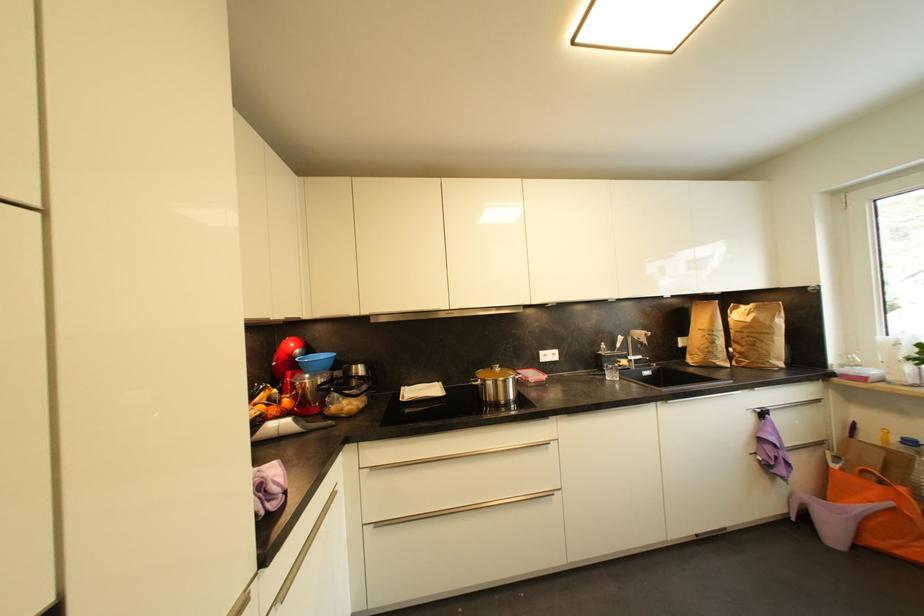
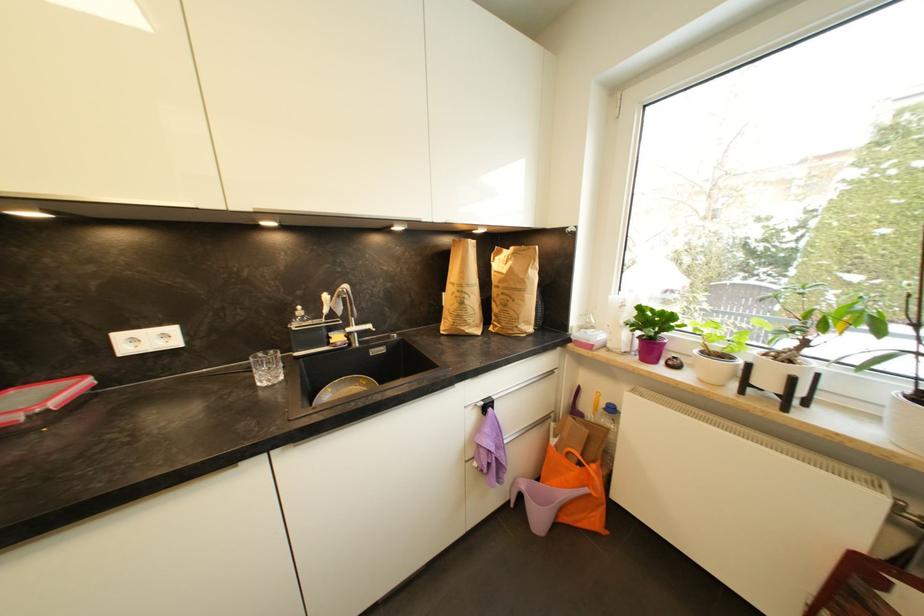
In a continuous first-person perspective shot, in which direction is the camera moving?

The cameraman walked toward right, forward.